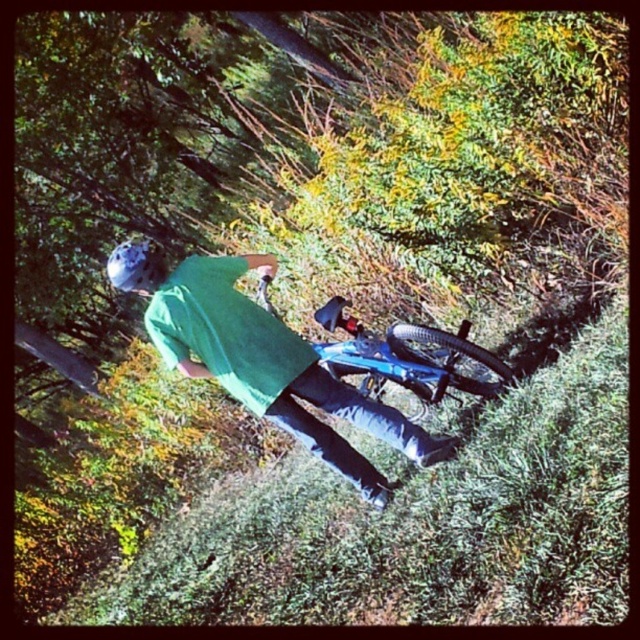
Question: Which point is closer to the camera taking this photo?

Choices:
 (A) (120, 284)
 (B) (330, 346)

Answer: (A)

Question: Is blue matte mountain bike at center positioned behind matte blue helmet at upper left?

Choices:
 (A) yes
 (B) no

Answer: (A)

Question: Which point is closer to the camera?

Choices:
 (A) [464, 385]
 (B) [116, 275]

Answer: (B)

Question: Is blue matte mountain bike at center wider than matte blue helmet at upper left?

Choices:
 (A) no
 (B) yes

Answer: (B)

Question: Is blue matte mountain bike at center wider than matte blue helmet at upper left?

Choices:
 (A) no
 (B) yes

Answer: (B)

Question: Which of the following is the closest to the observer?

Choices:
 (A) (148, 285)
 (B) (346, 323)

Answer: (A)